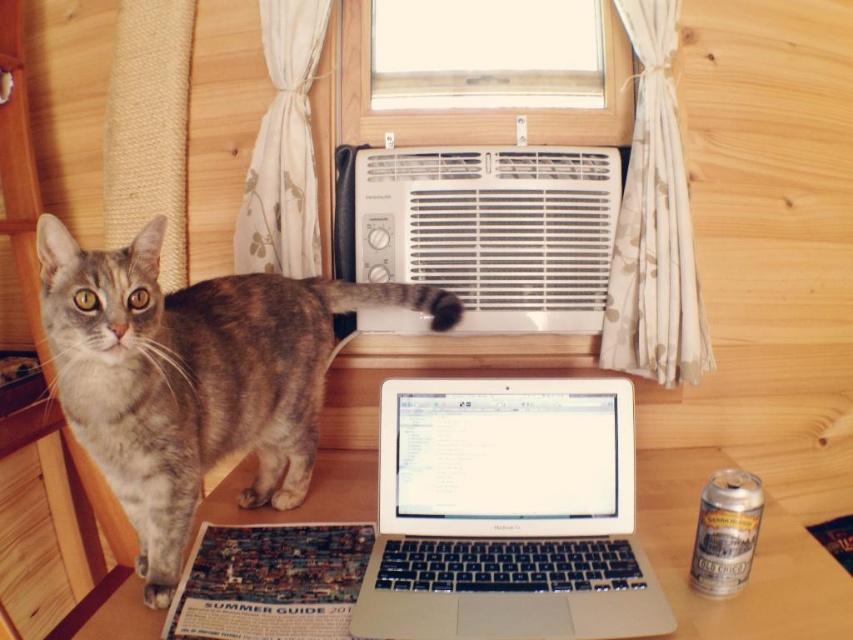
From the picture: What is located at the coordinates point (508,513)?

The silver metallic laptop at center is located at point (508,513).

You are a delivery person who needs to place a small package on the table where the gray tabby cat at left and the white plastic air conditioner at upper center are located. Considering their sizes, which object should you avoid placing the package near to ensure it doesn

The gray tabby cat at left is larger in size than the white plastic air conditioner at upper center. To ensure the package has enough space, avoid placing it near the gray tabby cat at left since it takes up more space on the table.